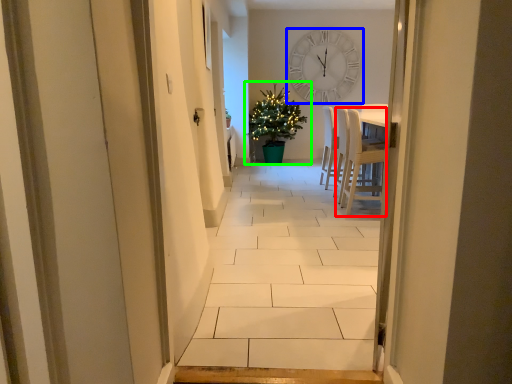
Question: Considering the real-world distances, which object is closest to chair (highlighted by a red box)? wall clock (highlighted by a blue box) or houseplant (highlighted by a green box).

Choices:
 (A) wall clock
 (B) houseplant

Answer: (B)